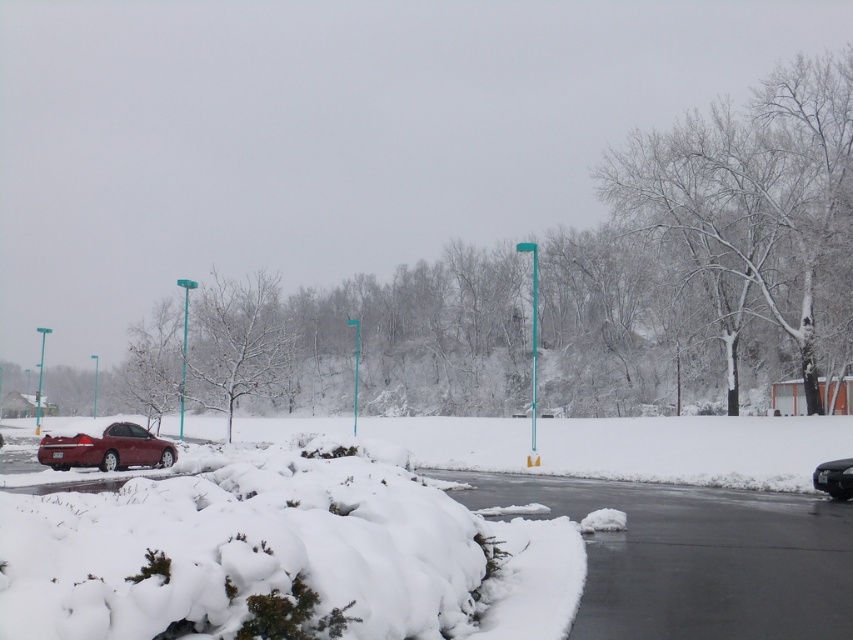
Question: Can you confirm if shiny red sedan at left is positioned below shiny black sedan at lower right?

Choices:
 (A) no
 (B) yes

Answer: (A)

Question: Can you confirm if shiny red sedan at left is smaller than shiny black sedan at lower right?

Choices:
 (A) no
 (B) yes

Answer: (A)

Question: Which point is closer to the camera?

Choices:
 (A) (851, 468)
 (B) (103, 465)

Answer: (A)

Question: Among these objects, which one is nearest to the camera?

Choices:
 (A) shiny red sedan at left
 (B) shiny black sedan at lower right

Answer: (B)

Question: Observing the image, what is the correct spatial positioning of shiny red sedan at left in reference to shiny black sedan at lower right?

Choices:
 (A) left
 (B) right

Answer: (A)

Question: Which object appears farthest from the camera in this image?

Choices:
 (A) shiny red sedan at left
 (B) shiny black sedan at lower right

Answer: (A)